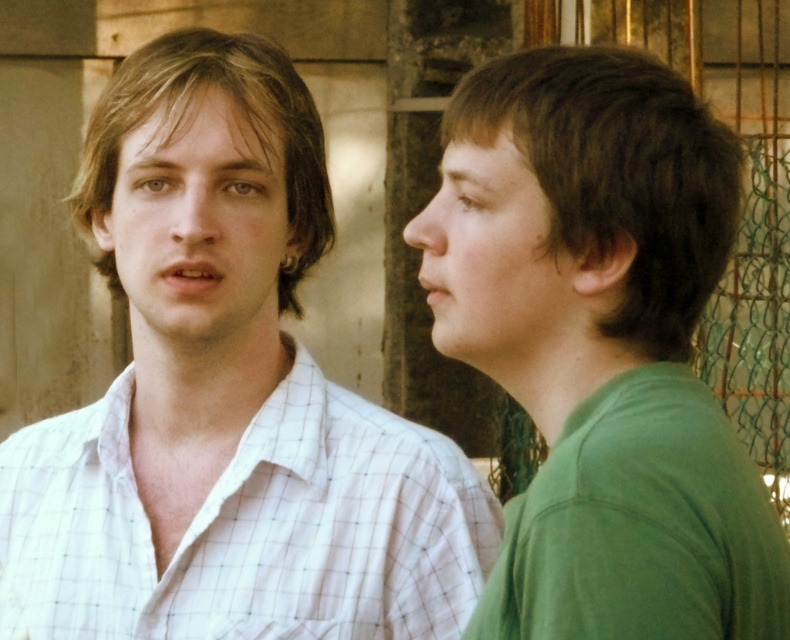
You are a tailor measuring shirts for alterations. You have a customer who wants to know if their green matte shirt at right can fit into a garment bag designed for shirts up to 18 inches wide. Given that the white checkered shirt at left is known to be 20 inches wide, what should you tell them?

The green matte shirt at right has a lesser width compared to the white checkered shirt at left, which is 20 inches wide. Therefore, the green matte shirt at right is narrower than 20 inches. Since the garment bag can hold shirts up to 18 inches wide, the green matte shirt at right should fit comfortably within the bag.

You are standing in front of the two people in the image and want to place a small flowerpot between them. The flowerpot must be placed exactly halfway between the two points labeled as point [681,296] and point [96,525]. Considering their positions, will the flowerpot be closer to the person on the left or the person on the right?

The flowerpot placed exactly halfway between point [681,296] and point [96,525] will be closer to the person on the right because point [681,296] is closer to the viewer than point [96,525].

You are a photographer setting up for a portrait. You want to ensure that the green matte shirt at right and the white checkered shirt at left are both visible in the frame. Based on their positions, which shirt should you focus on first to ensure both are in focus?

The green matte shirt at right is located above the white checkered shirt at left. To ensure both are in focus, focus on the green matte shirt at right first since it is higher up, allowing the depth of field to cover the lower positioned white checkered shirt at left.